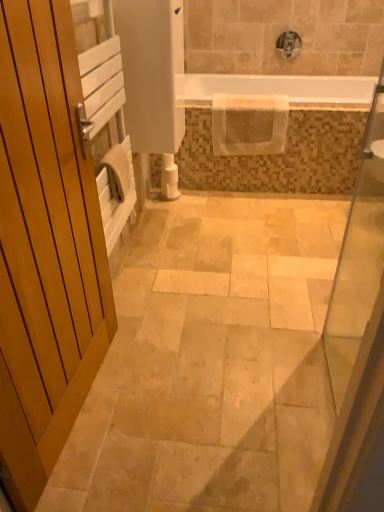
Question: Choose the correct answer: Is white matte toilet paper at center inside transparent glass door at right or outside it?

Choices:
 (A) inside
 (B) outside

Answer: (B)

Question: Based on their sizes in the image, would you say white matte toilet paper at center is bigger or smaller than transparent glass door at right?

Choices:
 (A) big
 (B) small

Answer: (B)

Question: Based on their relative distances, which object is nearer to the wooden door at left?

Choices:
 (A) white textured towel at center
 (B) transparent glass door at right
 (C) satin nickel faucet at upper center
 (D) white matte toilet paper at center
 (E) white textured towel at upper center

Answer: (B)

Question: Which object is the closest to the white textured towel at upper center?

Choices:
 (A) satin nickel faucet at upper center
 (B) wooden door at left
 (C) transparent glass door at right
 (D) white textured towel at center
 (E) white matte toilet paper at center

Answer: (A)